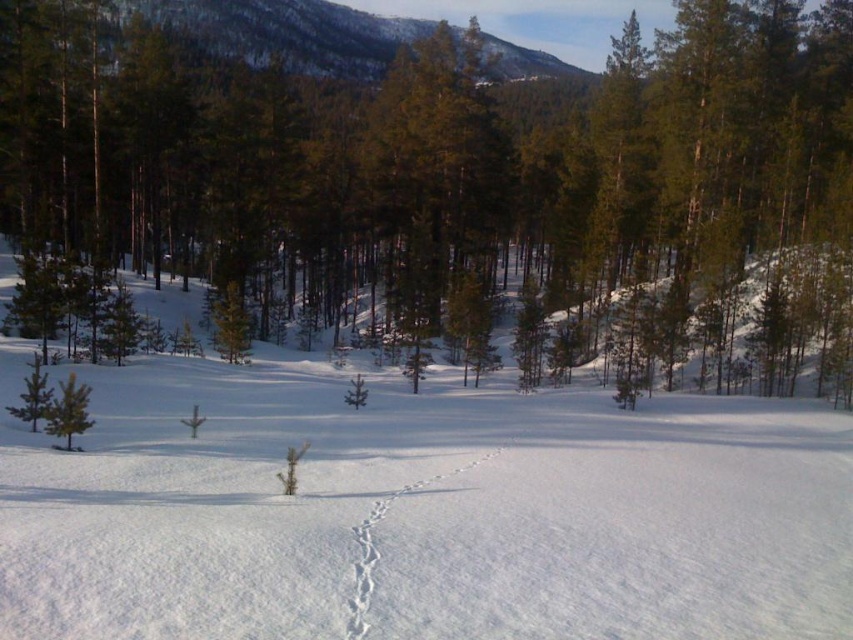
Question: Among these objects, which one is farthest from the camera?

Choices:
 (A) green matte tree at center
 (B) white fluffy snow at center
 (C) green matte tree at lower left
 (D) white powdery snow trail at center

Answer: (A)

Question: Which point is closer to the camera taking this photo?

Choices:
 (A) (717, 448)
 (B) (643, 348)
 (C) (469, 461)
 (D) (76, 394)

Answer: (D)

Question: Does white fluffy snow at center have a larger size compared to white powdery snow trail at center?

Choices:
 (A) no
 (B) yes

Answer: (B)

Question: Can you confirm if white fluffy snow at center is smaller than green matte tree at lower left?

Choices:
 (A) yes
 (B) no

Answer: (B)

Question: Which object is positioned closest to the white fluffy snow at center?

Choices:
 (A) white powdery snow trail at center
 (B) green matte tree at lower left
 (C) green matte tree at center

Answer: (A)

Question: Does green matte tree at center have a smaller size compared to white fluffy snow at center?

Choices:
 (A) yes
 (B) no

Answer: (B)